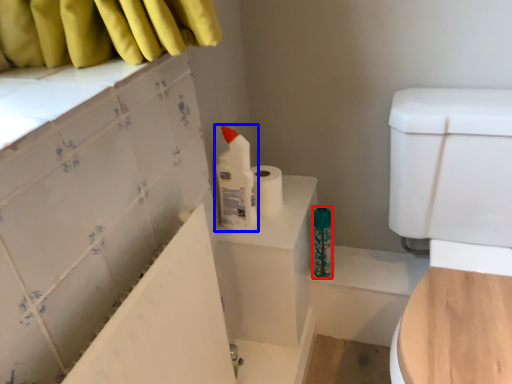
Question: Which of the following is the closest to the observer, toiletry (highlighted by a red box) or cleaning product (highlighted by a blue box)?

Choices:
 (A) toiletry
 (B) cleaning product

Answer: (B)